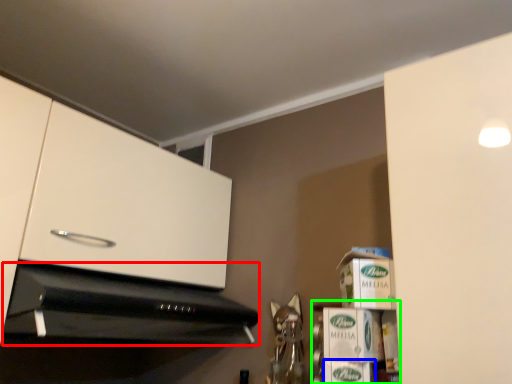
Question: Based on their relative distances, which object is farther from home appliance (highlighted by a red box)? Choose from cardboard box (highlighted by a blue box) and shelf (highlighted by a green box).

Choices:
 (A) cardboard box
 (B) shelf

Answer: (A)